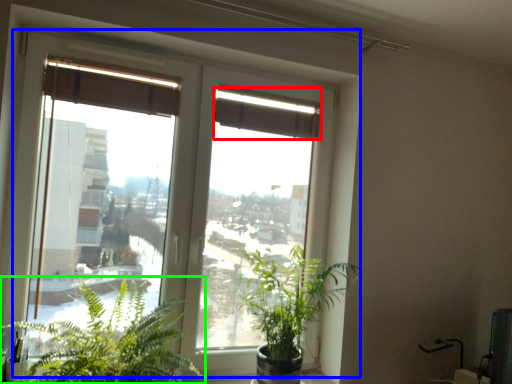
Question: Based on their relative distances, which object is nearer to curtain (highlighted by a red box)? Choose from window (highlighted by a blue box) and houseplant (highlighted by a green box).

Choices:
 (A) window
 (B) houseplant

Answer: (A)